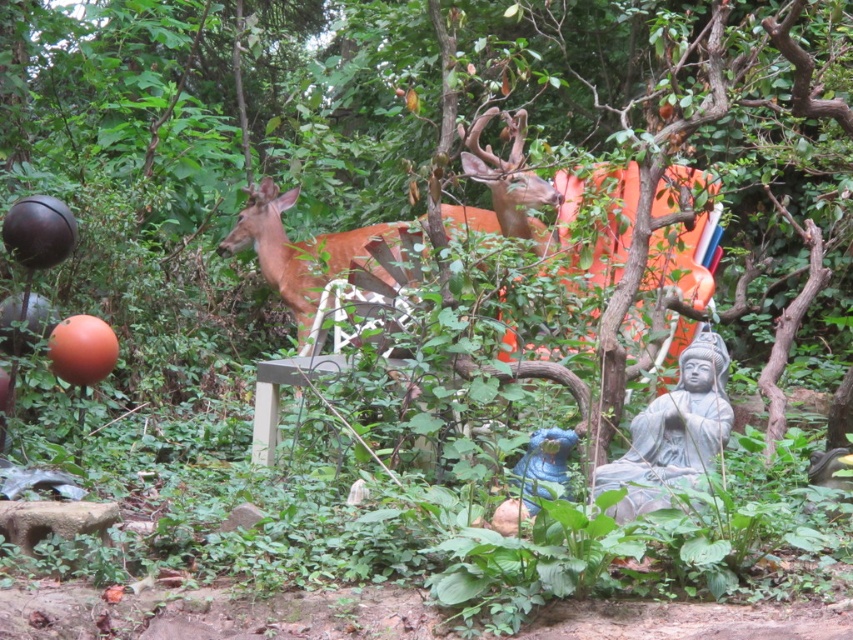
The image size is (853, 640). What are the coordinates of `green leafy tree at center` in the screenshot? It's located at (209, 134).

Which of these two, green leafy tree at center or brown matte/deer at center, stands shorter?

Standing shorter between the two is brown matte/deer at center.

Does point (840, 131) come farther from viewer compared to point (364, 228)?

No.

The height and width of the screenshot is (640, 853). Identify the location of green leafy tree at center. (209, 134).

Is green leafy tree at center smaller than gray stone statue at lower right?

Incorrect, green leafy tree at center is not smaller in size than gray stone statue at lower right.

How far apart are green leafy tree at center and gray stone statue at lower right?

A distance of 51.94 feet exists between green leafy tree at center and gray stone statue at lower right.

Find the location of `green leafy tree at center`. green leafy tree at center is located at coordinates (209, 134).

Between point (726, 420) and point (397, 227), which one is positioned behind?

Positioned behind is point (397, 227).

Where is `gray stone statue at lower right`? The width and height of the screenshot is (853, 640). gray stone statue at lower right is located at coordinates (672, 433).

Where is `gray stone statue at lower right`? This screenshot has width=853, height=640. gray stone statue at lower right is located at coordinates (672, 433).